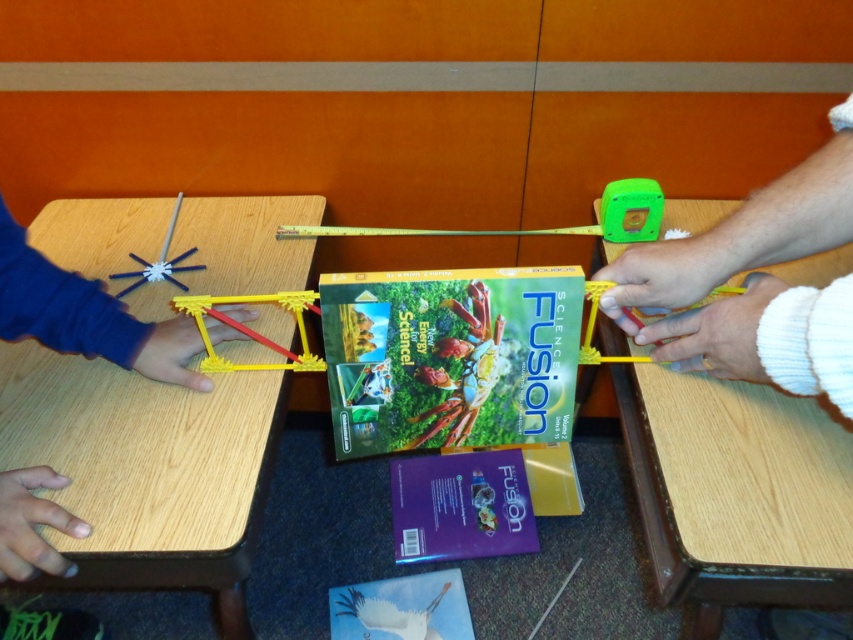
You are a student who needs to place a book on the wooden table at left and the green matte toy at upper right. Which object can the book be placed on without falling off?

The book can be placed on the wooden table at left because it is taller than the green matte toy at upper right, providing a stable surface.

You are a student who needs to choose between the green matte toy at upper right and the metallic ruler at center for a project that requires a larger object. Which one should you pick?

The metallic ruler at center is larger than the green matte toy at upper right, so you should pick the metallic ruler at center for your project.